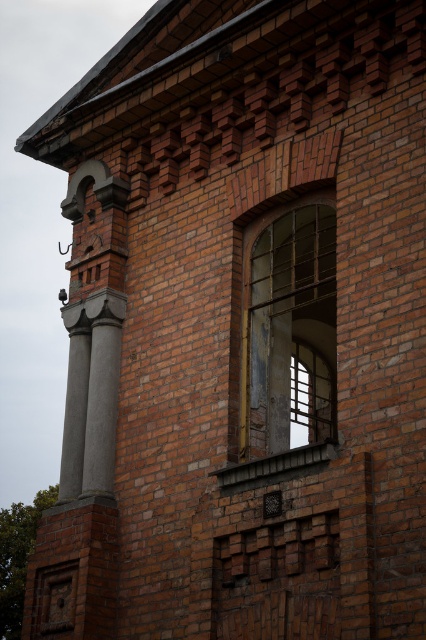
Question: Does translucent glass window at center have a greater width compared to smooth concrete column at center?

Choices:
 (A) no
 (B) yes

Answer: (A)

Question: Among these points, which one is nearest to the camera?

Choices:
 (A) (284, 397)
 (B) (68, 392)
 (C) (109, 428)

Answer: (A)

Question: Which point is closer to the camera?

Choices:
 (A) gray concrete column at left
 (B) translucent glass window at center
 (C) smooth concrete column at center

Answer: (B)

Question: Does translucent glass window at center appear on the right side of smooth concrete column at center?

Choices:
 (A) no
 (B) yes

Answer: (B)

Question: Which point is closer to the camera?

Choices:
 (A) (322, 410)
 (B) (89, 460)
 (C) (68, 312)

Answer: (B)

Question: Is gray concrete column at left to the left of smooth concrete column at center from the viewer's perspective?

Choices:
 (A) yes
 (B) no

Answer: (B)